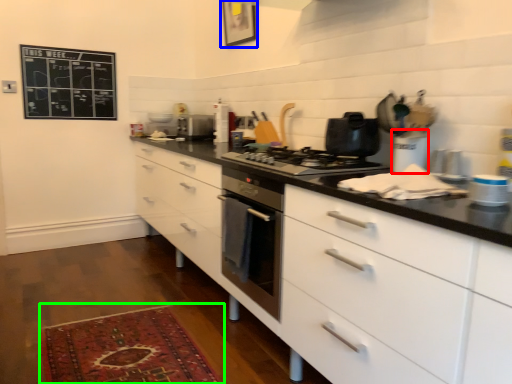
Question: Estimate the real-world distances between objects in this image. Which object is closer to appliance (highlighted by a red box), picture frame (highlighted by a blue box) or mat (highlighted by a green box)?

Choices:
 (A) picture frame
 (B) mat

Answer: (B)